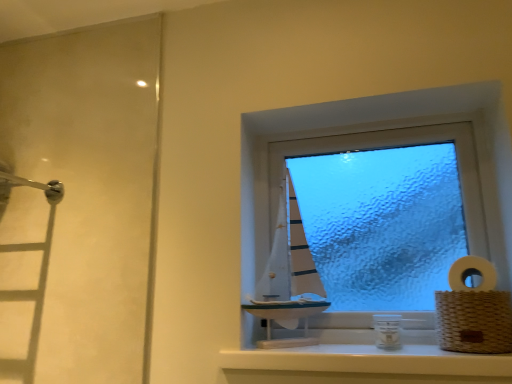
At what (x,y) coordinates should I click in order to perform the action: click on transparent frosted glass sailboat at center. Please return your answer as a coordinate pair (x, y). Image resolution: width=512 pixels, height=384 pixels. Looking at the image, I should click on (371, 131).

This screenshot has height=384, width=512. I want to click on white woven basket at right, so click(x=472, y=274).

Locate an element on the screen. woven brown basket at right is located at coordinates (474, 321).

Would you say white woven basket at right contains white glossy window sill at center?

No, white glossy window sill at center is not inside white woven basket at right.

From the image's perspective, is white woven basket at right positioned above or below white glossy window sill at center?

white woven basket at right is above white glossy window sill at center.

From the picture: Is white woven basket at right taller or shorter than white glossy window sill at center?

In the image, white woven basket at right appears to be taller than white glossy window sill at center.

From a real-world perspective, which is physically above, white woven basket at right or white glossy window sill at center?

From a 3D spatial view, white woven basket at right is above.

Which of these two, white woven basket at right or transparent frosted glass sailboat at center, stands shorter?

white woven basket at right.

Between white woven basket at right and transparent frosted glass sailboat at center, which one appears on the right side from the viewer's perspective?

Positioned to the right is white woven basket at right.

Consider the image. Considering the positions of objects white woven basket at right and transparent frosted glass sailboat at center in the image provided, who is behind, white woven basket at right or transparent frosted glass sailboat at center?

transparent frosted glass sailboat at center.

How many degrees apart are the facing directions of white woven basket at right and transparent frosted glass sailboat at center?

They differ by 14.2 degrees in their facing directions.

Measure the distance between woven brown basket at right and white glossy window sill at center.

woven brown basket at right and white glossy window sill at center are 6.49 inches apart.

Is woven brown basket at right in contact with white glossy window sill at center?

No, woven brown basket at right is not making contact with white glossy window sill at center.

Which of these two, woven brown basket at right or white glossy window sill at center, is wider?

white glossy window sill at center.

Which point is more forward, (511, 331) or (510, 354)?

Point (510, 354)

Does white glossy window sill at center have a lesser width compared to transparent frosted glass sailboat at center?

No.

Is white glossy window sill at center not near transparent frosted glass sailboat at center?

That's not correct — white glossy window sill at center is a little close to transparent frosted glass sailboat at center.

Is white glossy window sill at center further to camera compared to transparent frosted glass sailboat at center?

No, the depth of white glossy window sill at center is less than that of transparent frosted glass sailboat at center.

Can you tell me how much white glossy window sill at center and transparent frosted glass sailboat at center differ in facing direction?

They differ by 0.0362 degrees in their facing directions.

Between transparent frosted glass sailboat at center and white woven basket at right, which one has less height?

white woven basket at right is shorter.

Can we say transparent frosted glass sailboat at center lies outside white woven basket at right?

transparent frosted glass sailboat at center is positioned outside white woven basket at right.

Is transparent frosted glass sailboat at center not near white woven basket at right?

That's not correct — transparent frosted glass sailboat at center is a little close to white woven basket at right.

Is transparent frosted glass sailboat at center oriented towards white woven basket at right?

Yes, transparent frosted glass sailboat at center is aimed at white woven basket at right.

Is point (226, 350) farther from camera compared to point (450, 306)?

Yes, it is.

Is white glossy window sill at center positioned with its back to woven brown basket at right?

No.

Who is shorter, white glossy window sill at center or woven brown basket at right?

white glossy window sill at center is shorter.

How much distance is there between white glossy window sill at center and woven brown basket at right?

white glossy window sill at center and woven brown basket at right are 6.49 inches apart from each other.

At what (x,y) coordinates should I click in order to perform the action: click on basket below the transparent frosted glass sailboat at center (from the image's perspective). Please return your answer as a coordinate pair (x, y). The height and width of the screenshot is (384, 512). Looking at the image, I should click on (474, 321).

Based on the photo, from a real-world perspective, is transparent frosted glass sailboat at center above or below woven brown basket at right?

In terms of real-world spatial position, transparent frosted glass sailboat at center is above woven brown basket at right.

Considering the relative positions of transparent frosted glass sailboat at center and woven brown basket at right in the image provided, is transparent frosted glass sailboat at center in front of woven brown basket at right?

No, transparent frosted glass sailboat at center is further to the viewer.

Does transparent frosted glass sailboat at center have a greater width compared to woven brown basket at right?

In fact, transparent frosted glass sailboat at center might be narrower than woven brown basket at right.

In the image, there is a white woven basket at right. Identify the location of window sill below it (from the image's perspective). The width and height of the screenshot is (512, 384). (368, 360).

Find the location of a particular element. Image resolution: width=512 pixels, height=384 pixels. toilet paper in front of the transparent frosted glass sailboat at center is located at coordinates (472, 274).

When comparing their distances from white woven basket at right, does transparent frosted glass sailboat at center or woven brown basket at right seem closer?

woven brown basket at right.

Based on their spatial positions, is woven brown basket at right or white woven basket at right closer to transparent frosted glass sailboat at center?

woven brown basket at right lies closer to transparent frosted glass sailboat at center than the other object.

From the image, which object appears to be farther from white glossy window sill at center, transparent frosted glass sailboat at center or woven brown basket at right?

Based on the image, transparent frosted glass sailboat at center appears to be further to white glossy window sill at center.

Looking at the image, which one is located closer to transparent frosted glass sailboat at center, white glossy window sill at center or woven brown basket at right?

woven brown basket at right is closer to transparent frosted glass sailboat at center.

When comparing their distances from white woven basket at right, does woven brown basket at right or transparent frosted glass sailboat at center seem closer?

Based on the image, woven brown basket at right appears to be nearer to white woven basket at right.

Estimate the real-world distances between objects in this image. Which object is closer to woven brown basket at right, white woven basket at right or white glossy window sill at center?

white woven basket at right is closer to woven brown basket at right.

Based on the photo, from the image, which object appears to be nearer to white glossy window sill at center, transparent frosted glass sailboat at center or white woven basket at right?

Among the two, white woven basket at right is located nearer to white glossy window sill at center.

Looking at the image, which one is located closer to white glossy window sill at center, white woven basket at right or transparent frosted glass sailboat at center?

The object closer to white glossy window sill at center is white woven basket at right.

At what (x,y) coordinates should I click in order to perform the action: click on basket between transparent frosted glass sailboat at center and white woven basket at right in the horizontal direction. Please return your answer as a coordinate pair (x, y). Looking at the image, I should click on (474, 321).

Identify the location of basket located between white glossy window sill at center and white woven basket at right in the left-right direction. Image resolution: width=512 pixels, height=384 pixels. (474, 321).

Locate an element on the screen. toilet paper between transparent frosted glass sailboat at center and white glossy window sill at center from top to bottom is located at coordinates (472, 274).

Identify the location of basket between transparent frosted glass sailboat at center and white glossy window sill at center in the up-down direction. Image resolution: width=512 pixels, height=384 pixels. [x=474, y=321].